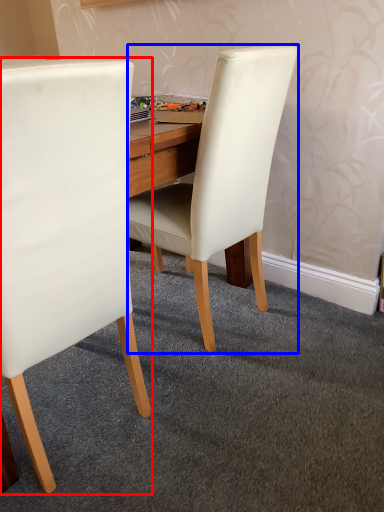
Question: Which of the following is the farthest to the observer, chair (highlighted by a red box) or chair (highlighted by a blue box)?

Choices:
 (A) chair
 (B) chair

Answer: (B)